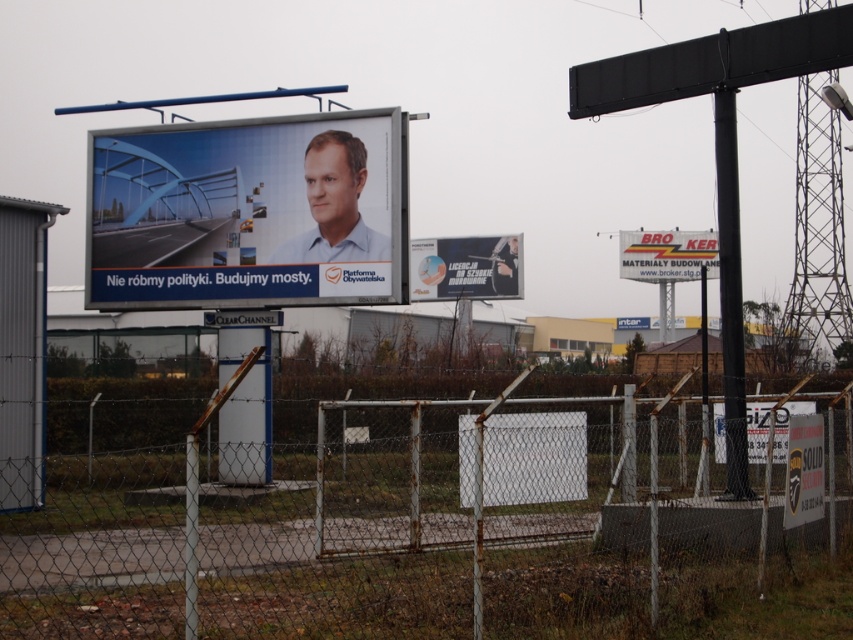
Does rusty chain-link fence at lower center appear on the left side of matte plastic billboard at center?

No, rusty chain-link fence at lower center is not to the left of matte plastic billboard at center.

Who is positioned more to the right, rusty chain-link fence at lower center or matte plastic billboard at center?

rusty chain-link fence at lower center

Which is behind, point (213, 592) or point (107, 195)?

Positioned behind is point (107, 195).

Locate an element on the screen. rusty chain-link fence at lower center is located at coordinates (434, 522).

Does rusty chain-link fence at lower center have a larger size compared to black glossy poster at center?

Indeed, rusty chain-link fence at lower center has a larger size compared to black glossy poster at center.

Is point (126, 554) farther from viewer compared to point (467, 276)?

That is False.

This screenshot has width=853, height=640. What are the coordinates of `rusty chain-link fence at lower center` in the screenshot? It's located at (434, 522).

The width and height of the screenshot is (853, 640). Describe the element at coordinates (434, 522) in the screenshot. I see `rusty chain-link fence at lower center` at that location.

Locate an element on the screen. The height and width of the screenshot is (640, 853). rusty chain-link fence at lower center is located at coordinates (434, 522).

Locate an element on the screen. rusty chain-link fence at lower center is located at coordinates (434, 522).